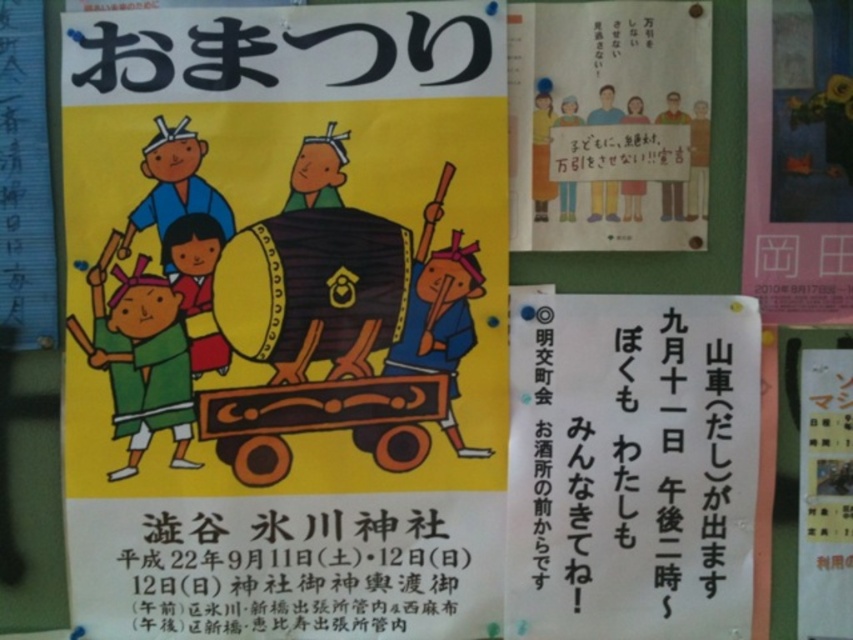
Question: Is black paper text at lower center thinner than white paper poster at upper right?

Choices:
 (A) yes
 (B) no

Answer: (B)

Question: Which is farther from the metallic gold frame at upper right?

Choices:
 (A) black paper text at center
 (B) wooden drum at center

Answer: (B)

Question: Is matte paper poster at upper center thinner than metallic gold frame at upper right?

Choices:
 (A) yes
 (B) no

Answer: (B)

Question: Among these objects, which one is farthest from the camera?

Choices:
 (A) white paper poster at upper right
 (B) wooden wagon at center
 (C) wooden drum at center
 (D) matte paper poster at upper center

Answer: (A)

Question: Is black paper text at center to the left of black paper text at lower center from the viewer's perspective?

Choices:
 (A) no
 (B) yes

Answer: (A)

Question: Among these objects, which one is nearest to the camera?

Choices:
 (A) wooden wagon at center
 (B) white paper poster at upper right
 (C) black paper text at center

Answer: (A)